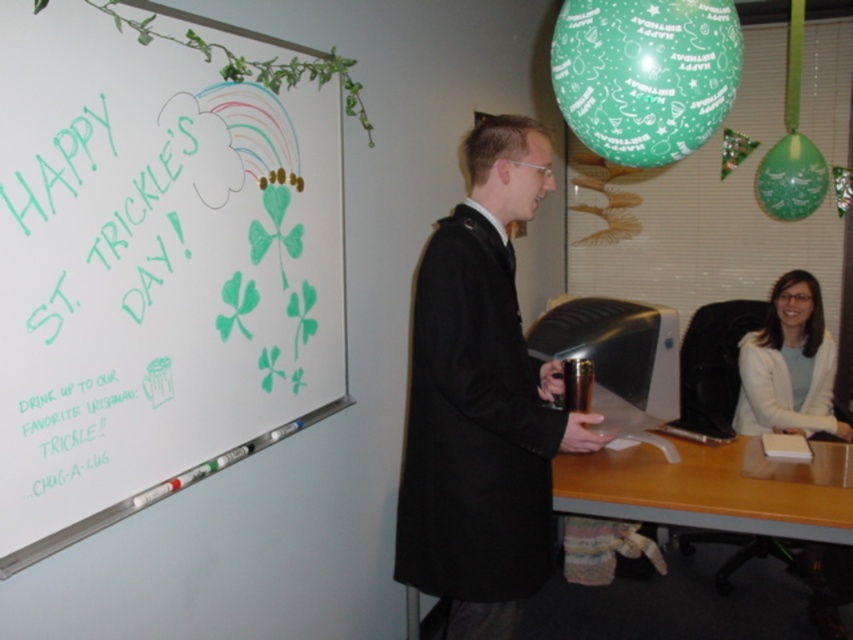
Is green chalk writing at upper left shorter than black wool coat at center?

Indeed, green chalk writing at upper left has a lesser height compared to black wool coat at center.

Does green chalk writing at upper left appear on the right side of black wool coat at center?

No, green chalk writing at upper left is not to the right of black wool coat at center.

The height and width of the screenshot is (640, 853). In order to click on green chalk writing at upper left in this screenshot , I will do `click(91, 292)`.

Is whiteboard at upper left to the left of white fabric shirt at right from the viewer's perspective?

Indeed, whiteboard at upper left is positioned on the left side of white fabric shirt at right.

Can you confirm if whiteboard at upper left is positioned below white fabric shirt at right?

Incorrect, whiteboard at upper left is not positioned below white fabric shirt at right.

Describe the element at coordinates (152, 272) in the screenshot. I see `whiteboard at upper left` at that location.

The width and height of the screenshot is (853, 640). I want to click on whiteboard at upper left, so click(x=152, y=272).

Between point (488, 602) and point (705, 449), which one is positioned in front?

Point (488, 602) is more forward.

Does black wool coat at center have a smaller size compared to wooden desk at lower right?

Actually, black wool coat at center might be larger than wooden desk at lower right.

Between point (483, 634) and point (840, 449), which one is positioned behind?

The point (840, 449) is behind.

Locate an element on the screen. This screenshot has height=640, width=853. black wool coat at center is located at coordinates (480, 401).